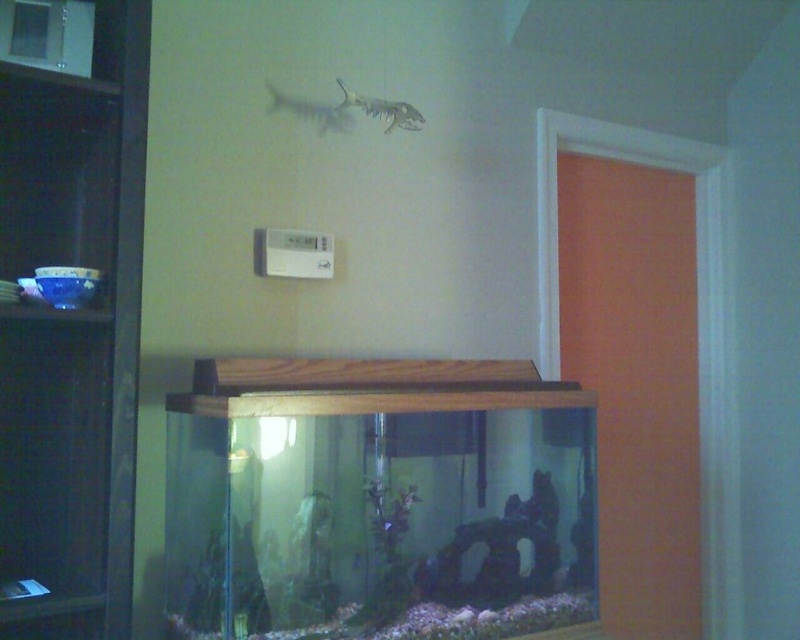
Question: Which point is closer to the camera?

Choices:
 (A) (358, 104)
 (B) (140, 250)

Answer: (B)

Question: Is dark wood bookshelf at left wider than translucent plastic fish at upper center?

Choices:
 (A) yes
 (B) no

Answer: (A)

Question: Does dark wood bookshelf at left have a greater width compared to translucent plastic fish at upper center?

Choices:
 (A) yes
 (B) no

Answer: (A)

Question: Which point is farther to the camera?

Choices:
 (A) (49, 211)
 (B) (408, 113)

Answer: (B)

Question: In this image, where is dark wood bookshelf at left located relative to translucent plastic fish at upper center?

Choices:
 (A) left
 (B) right

Answer: (A)